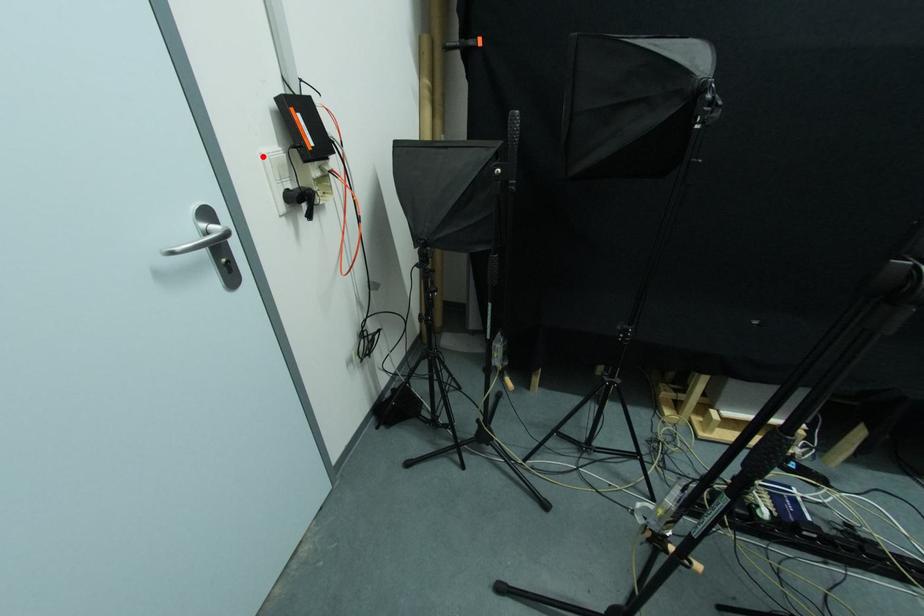
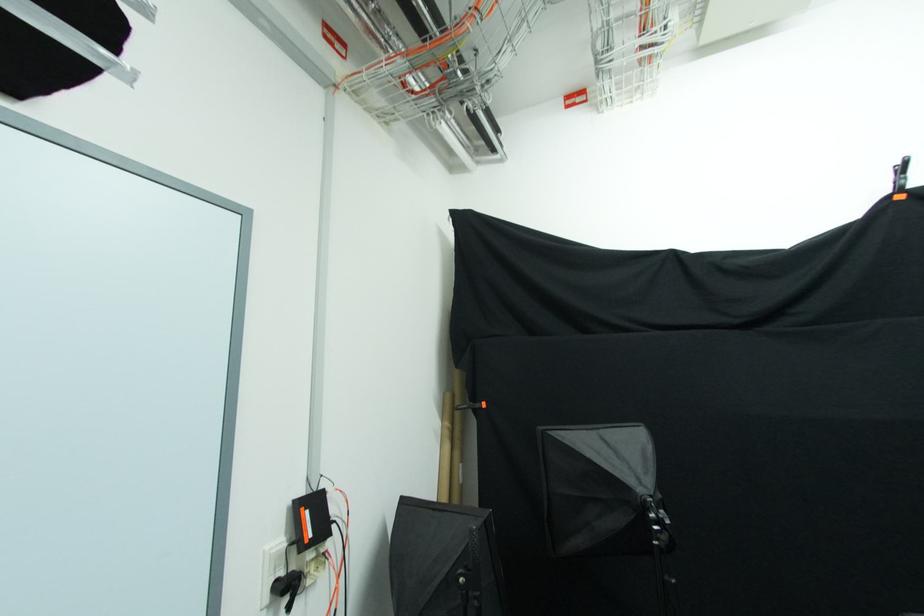
Locate, in the second image, the point that corresponds to the highlighted location in the first image.

(266, 554)